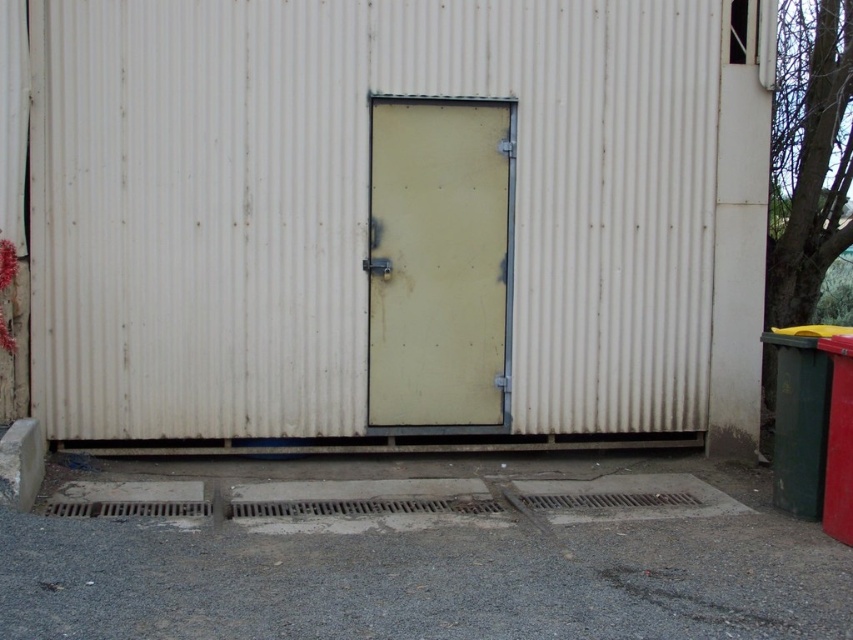
Question: Which point appears farthest from the camera in this image?

Choices:
 (A) (466, 168)
 (B) (170, 116)

Answer: (A)

Question: Which point is closer to the camera taking this photo?

Choices:
 (A) (157, 218)
 (B) (444, 276)

Answer: (A)

Question: Is white corrugated metal shed at center below yellow matte door at center?

Choices:
 (A) no
 (B) yes

Answer: (A)

Question: Is white corrugated metal shed at center to the left of yellow matte door at center from the viewer's perspective?

Choices:
 (A) yes
 (B) no

Answer: (B)

Question: Can you confirm if white corrugated metal shed at center is positioned to the right of yellow matte door at center?

Choices:
 (A) yes
 (B) no

Answer: (A)